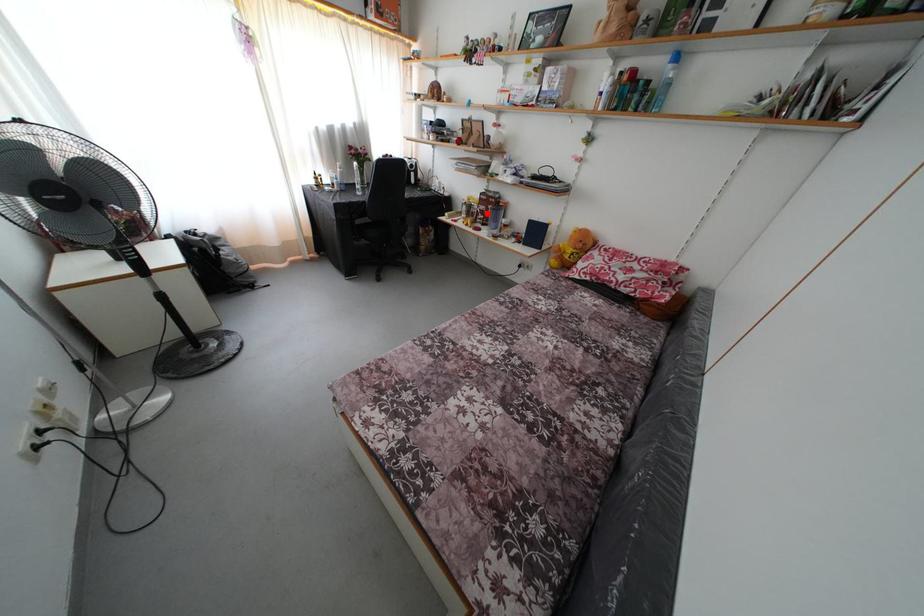
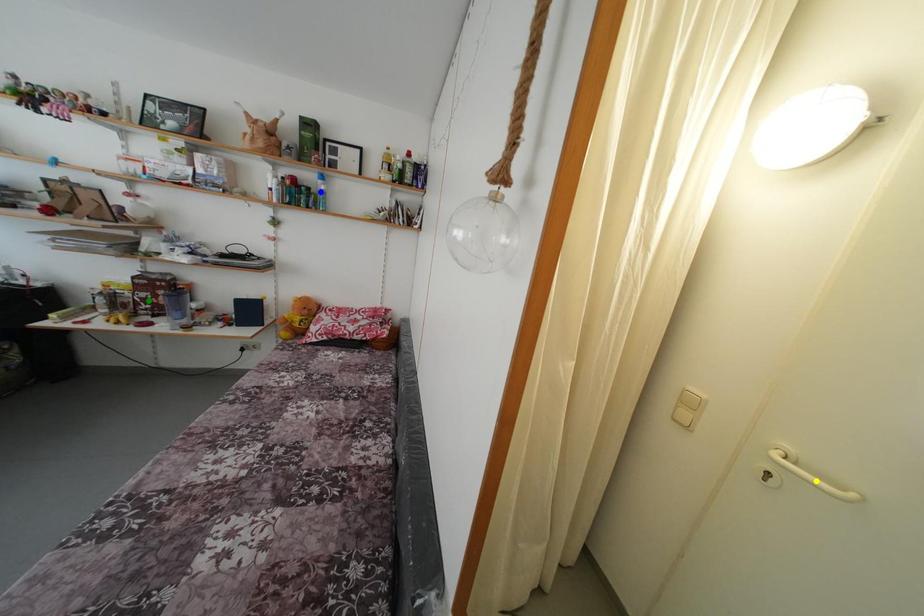
Question: I am providing you with two images of the same scene from different viewpoints. A red point is marked on the first image. You are given multiple points on the second image. Which spot in image 2 lines up with the point in image 1?

Choices:
 (A) green point
 (B) yellow point
 (C) blue point

Answer: (A)